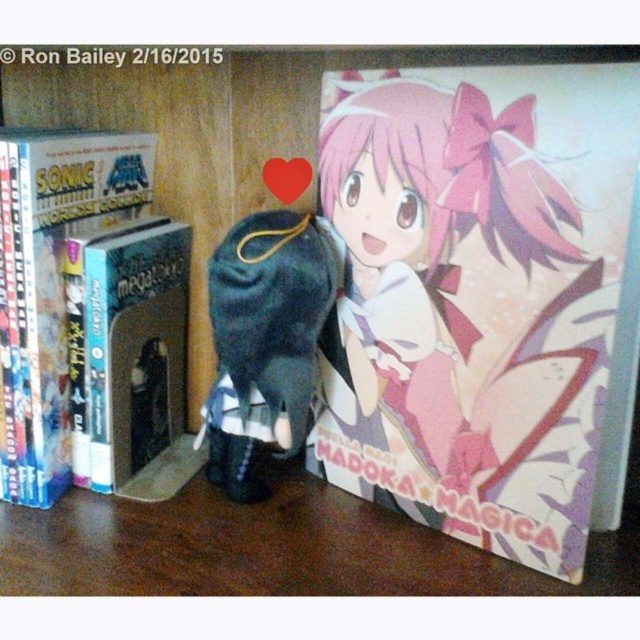
Question: Is the position of hardcover book at left less distant than that of velvet plush toy at center?

Choices:
 (A) no
 (B) yes

Answer: (B)

Question: Among these objects, which one is farthest from the camera?

Choices:
 (A) pink matte book at center
 (B) hardcover book at left
 (C) hardcover book at center
 (D) brown wooden table at center

Answer: (C)

Question: Does pink matte book at center appear on the right side of hardcover book at left?

Choices:
 (A) yes
 (B) no

Answer: (A)

Question: Which point is closer to the camera taking this photo?

Choices:
 (A) (380, 426)
 (B) (264, 340)
 (C) (420, 566)

Answer: (C)

Question: Which object appears farthest from the camera in this image?

Choices:
 (A) hardcover book at left
 (B) velvet plush toy at center

Answer: (B)

Question: Is pink matte book at center thinner than velvet plush toy at center?

Choices:
 (A) yes
 (B) no

Answer: (B)